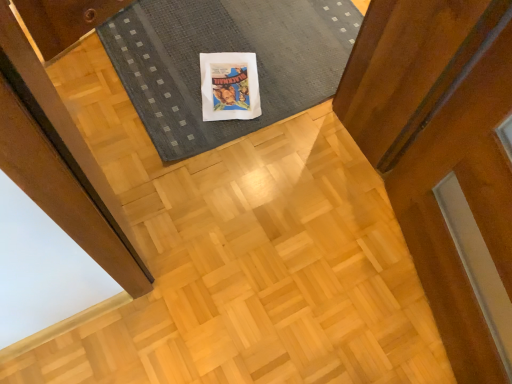
In order to click on free point above matte white comic book at center (from a real-world perspective) in this screenshot , I will do `click(226, 79)`.